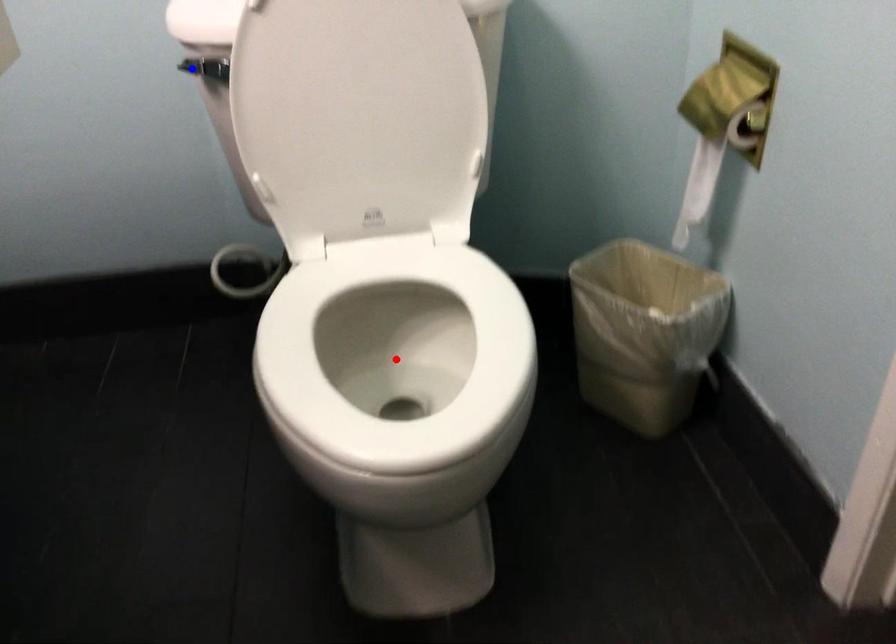
Question: In the image, two points are highlighted. Which point is nearer to the camera? Reply with the corresponding letter.

Choices:
 (A) blue point
 (B) red point

Answer: (B)